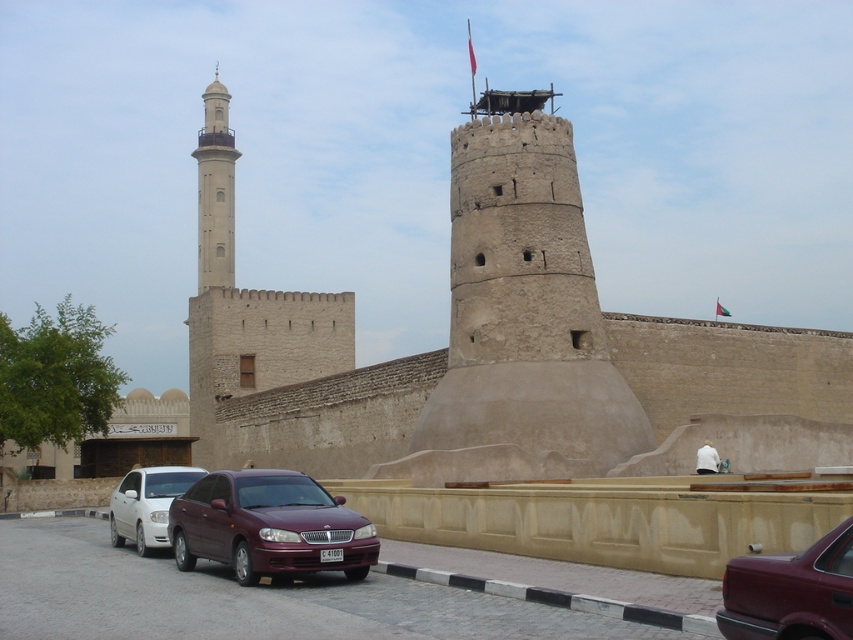
Based on the photo, can you confirm if brown stone fort at center is shorter than white matte sedan at center?

Incorrect, brown stone fort at center's height does not fall short of white matte sedan at center's.

Between brown stone fort at center and white matte sedan at center, which one is positioned lower?

white matte sedan at center

Who is more distant from viewer, (718, 321) or (160, 534)?

Positioned behind is point (718, 321).

Identify the location of brown stone fort at center. This screenshot has width=853, height=640. (511, 353).

Is maroon matte car at center positioned before light beige stone minaret at upper left?

That is True.

What do you see at coordinates (791, 593) in the screenshot?
I see `maroon matte car at center` at bounding box center [791, 593].

Who is more forward, (795, 616) or (196, 134)?

Point (795, 616) is more forward.

The width and height of the screenshot is (853, 640). Identify the location of maroon matte car at center. (791, 593).

Does point (824, 588) lie in front of point (119, 497)?

Yes, point (824, 588) is in front of point (119, 497).

Can you confirm if maroon matte car at center is shorter than white matte sedan at center?

Indeed, maroon matte car at center has a lesser height compared to white matte sedan at center.

Between point (813, 632) and point (112, 497), which one is positioned in front?

Point (813, 632) is in front.

The height and width of the screenshot is (640, 853). I want to click on maroon matte car at center, so click(x=791, y=593).